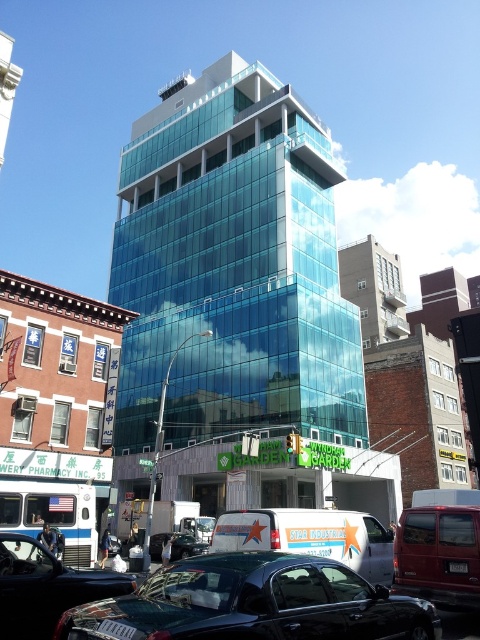
Question: Which point is farther to the camera?

Choices:
 (A) metallic red van at lower right
 (B) transparent glass building at center

Answer: (B)

Question: From the image, what is the correct spatial relationship of metallic red van at lower right in relation to metallic silver van at center?

Choices:
 (A) below
 (B) above

Answer: (B)

Question: Does white matte van at lower center appear on the right side of metallic silver van at center?

Choices:
 (A) yes
 (B) no

Answer: (A)

Question: Which object appears closest to the camera in this image?

Choices:
 (A) transparent glass building at center
 (B) shiny black sedan at lower left

Answer: (B)

Question: Considering the real-world distances, which object is closest to the transparent glass building at center?

Choices:
 (A) metallic red van at lower right
 (B) white matte van at lower center
 (C) metallic silver van at center

Answer: (B)

Question: Is metallic red van at lower right positioned in front of metallic silver van at center?

Choices:
 (A) yes
 (B) no

Answer: (A)